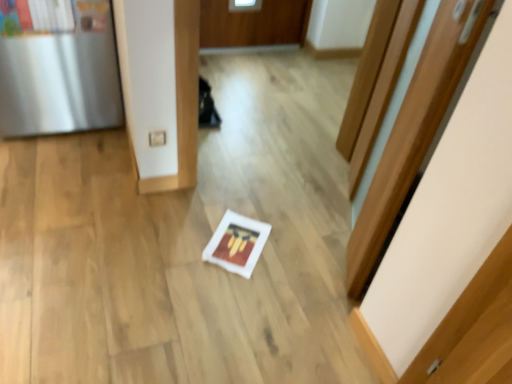
What do you see at coordinates (453, 245) in the screenshot?
I see `wooden door at center` at bounding box center [453, 245].

In order to click on wooden door at center in this screenshot , I will do `click(453, 245)`.

How much distance is there between wooden door at center and satin silver fridge at left?

A distance of 5.24 feet exists between wooden door at center and satin silver fridge at left.

Is wooden door at center bigger or smaller than satin silver fridge at left?

Clearly, wooden door at center is smaller in size than satin silver fridge at left.

Based on the photo, do you think wooden door at center is within satin silver fridge at left, or outside of it?

wooden door at center is spatially situated outside satin silver fridge at left.

How many degrees apart are the facing directions of wooden door at center and satin silver fridge at left?

120 degrees.

From a real-world perspective, is wooden door at center positioned above or below white matte frame at center?

In terms of real-world spatial position, wooden door at center is above white matte frame at center.

Considering the sizes of objects wooden door at center and white matte frame at center in the image provided, who is bigger, wooden door at center or white matte frame at center?

wooden door at center.

Based on the photo, what's the angular difference between wooden door at center and white matte frame at center's facing directions?

The facing directions of wooden door at center and white matte frame at center are 81.1 degrees apart.

Between wooden door at center and white matte frame at center, which one has larger width?

white matte frame at center.

Is satin silver fridge at left next to wooden door at center and touching it?

They are not placed beside each other.

Considering the relative positions of satin silver fridge at left and wooden door at center in the image provided, is satin silver fridge at left to the right of wooden door at center from the viewer's perspective?

In fact, satin silver fridge at left is to the left of wooden door at center.

Considering the sizes of satin silver fridge at left and wooden door at center in the image, is satin silver fridge at left bigger or smaller than wooden door at center?

Considering their sizes, satin silver fridge at left takes up more space than wooden door at center.

Is white matte frame at center aimed at satin silver fridge at left?

No, white matte frame at center is not aimed at satin silver fridge at left.

Considering the sizes of objects white matte frame at center and satin silver fridge at left in the image provided, who is shorter, white matte frame at center or satin silver fridge at left?

white matte frame at center.

Consider the image. Is satin silver fridge at left located within white matte frame at center?

Actually, satin silver fridge at left is outside white matte frame at center.

Can you tell me how much white matte frame at center and satin silver fridge at left differ in facing direction?

There is a 39-degree angle between the facing directions of white matte frame at center and satin silver fridge at left.

This screenshot has height=384, width=512. In order to click on copy beneath the wooden door at center (from a real-world perspective) in this screenshot , I will do `click(237, 243)`.

From the image's perspective, which one is positioned higher, white matte frame at center or wooden door at center?

wooden door at center, from the image's perspective.

From their relative heights in the image, would you say white matte frame at center is taller or shorter than wooden door at center?

Clearly, white matte frame at center is shorter compared to wooden door at center.

Is white matte frame at center with wooden door at center?

No, white matte frame at center is not touching wooden door at center.

From the image's perspective, is satin silver fridge at left under white matte frame at center?

Actually, satin silver fridge at left appears above white matte frame at center in the image.

Is satin silver fridge at left aimed at white matte frame at center?

No, satin silver fridge at left is not aimed at white matte frame at center.

Could white matte frame at center be considered to be inside satin silver fridge at left?

No.

Where is `fridge that is above the wooden door at center (from the image's perspective)`? fridge that is above the wooden door at center (from the image's perspective) is located at coordinates coord(57,67).

This screenshot has height=384, width=512. I want to click on copy that appears below the wooden door at center (from the image's perspective), so click(237, 243).

Looking at the image, which one is located further to wooden door at center, satin silver fridge at left or white matte frame at center?

The object further to wooden door at center is satin silver fridge at left.

When comparing their distances from white matte frame at center, does satin silver fridge at left or wooden door at center seem further?

satin silver fridge at left lies further to white matte frame at center than the other object.

Which object lies nearer to the anchor point white matte frame at center, wooden door at center or satin silver fridge at left?

The object closer to white matte frame at center is wooden door at center.

Which object lies further to the anchor point satin silver fridge at left, wooden door at center or white matte frame at center?

Based on the image, wooden door at center appears to be further to satin silver fridge at left.

When comparing their distances from satin silver fridge at left, does white matte frame at center or wooden door at center seem further?

Based on the image, wooden door at center appears to be further to satin silver fridge at left.

When comparing their distances from wooden door at center, does white matte frame at center or satin silver fridge at left seem closer?

white matte frame at center.

The width and height of the screenshot is (512, 384). Find the location of `copy located between satin silver fridge at left and wooden door at center in the left-right direction`. copy located between satin silver fridge at left and wooden door at center in the left-right direction is located at coordinates (237, 243).